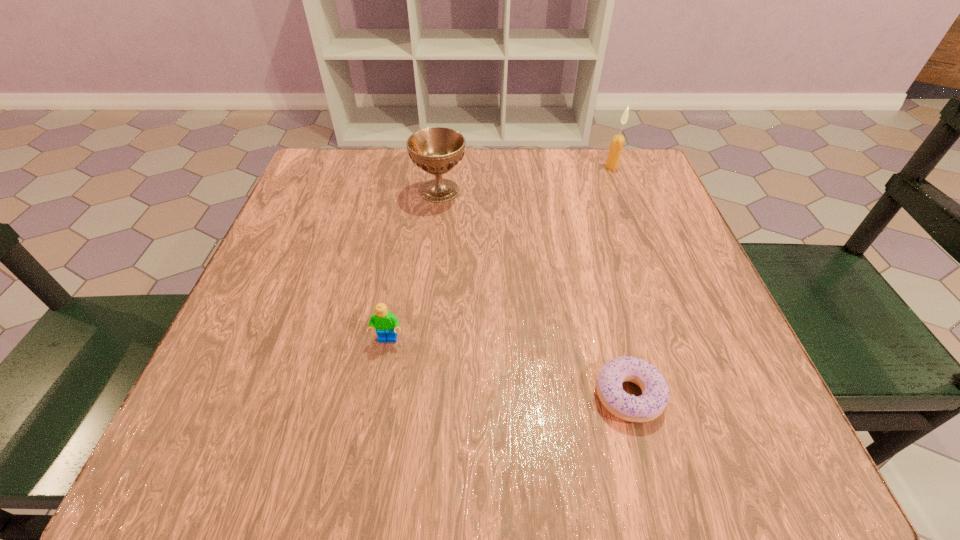
Where is `the rightmost object`? The image size is (960, 540). the rightmost object is located at coordinates (616, 146).

This screenshot has height=540, width=960. What are the coordinates of `candle` in the screenshot? It's located at (616, 146).

Locate an element on the screen. the third nearest object is located at coordinates (436, 150).

The width and height of the screenshot is (960, 540). I want to click on chalice, so click(x=436, y=150).

Where is `the second shortest object`? the second shortest object is located at coordinates (385, 323).

Locate an element on the screen. This screenshot has width=960, height=540. Lego is located at coordinates (385, 323).

What are the coordinates of `the nearest object` in the screenshot? It's located at (655, 391).

At what (x,y) coordinates should I click in order to perform the action: click on the third object from left to right. Please return your answer as a coordinate pair (x, y). Looking at the image, I should click on (655, 391).

Where is `vacant space located 0.400m on the left of the candle`? vacant space located 0.400m on the left of the candle is located at coordinates (444, 167).

Locate an element on the screen. The width and height of the screenshot is (960, 540). free location located 0.330m on the right of the third shortest object is located at coordinates (610, 191).